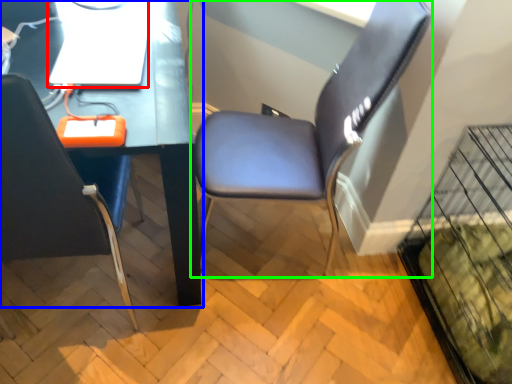
Question: Which is farther away from computer (highlighted by a red box)? computer desk (highlighted by a blue box) or chair (highlighted by a green box)?

Choices:
 (A) computer desk
 (B) chair

Answer: (B)